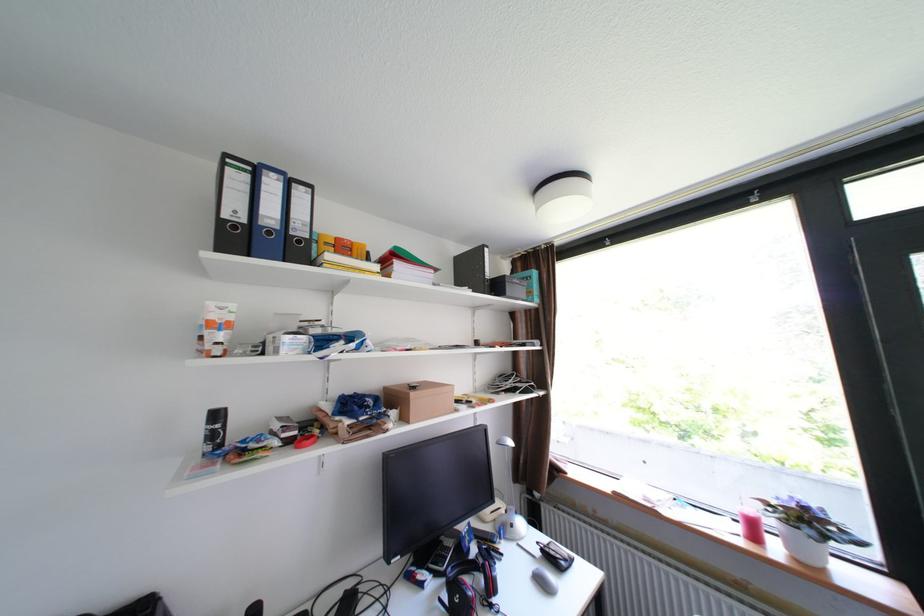
Find where to lift the brown cardboard box. Please return your answer as a coordinate pair (x, y).

(419, 400)